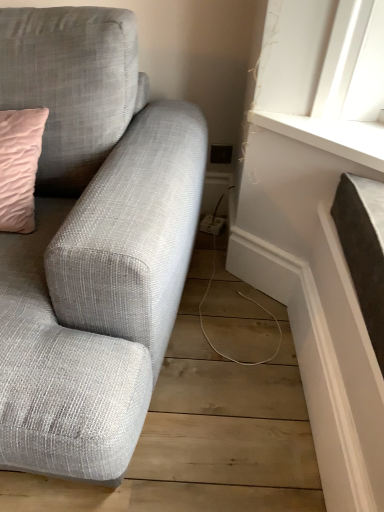
Measure the distance between point (65, 303) and camera.

Point (65, 303) and camera are 88.90 centimeters apart.

At what (x,y) coordinates should I click in order to perform the action: click on textured gray couch at left. Please return your answer as a coordinate pair (x, y). The height and width of the screenshot is (512, 384). Looking at the image, I should click on (91, 242).

This screenshot has height=512, width=384. What do you see at coordinates (91, 242) in the screenshot? I see `textured gray couch at left` at bounding box center [91, 242].

Locate an element on the screen. textured gray couch at left is located at coordinates (91, 242).